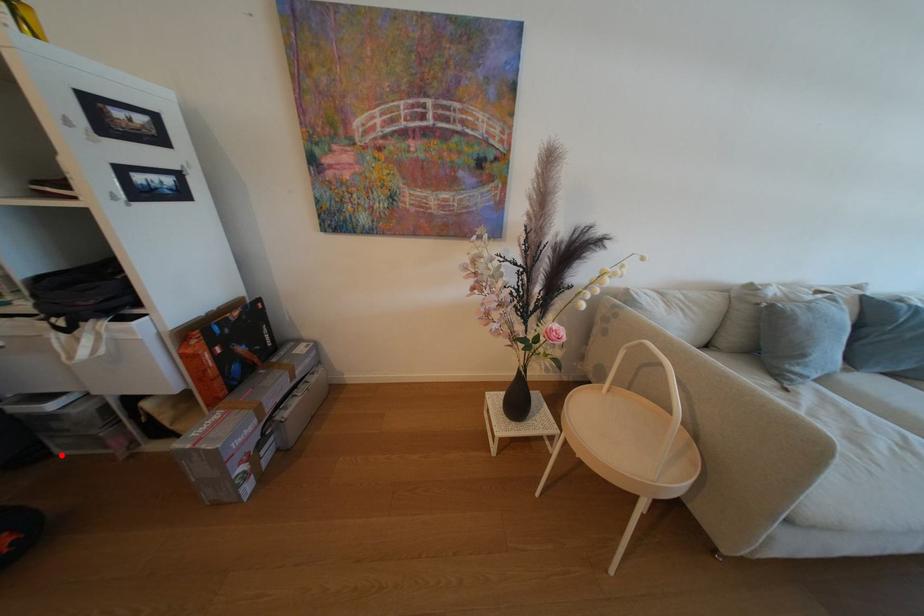
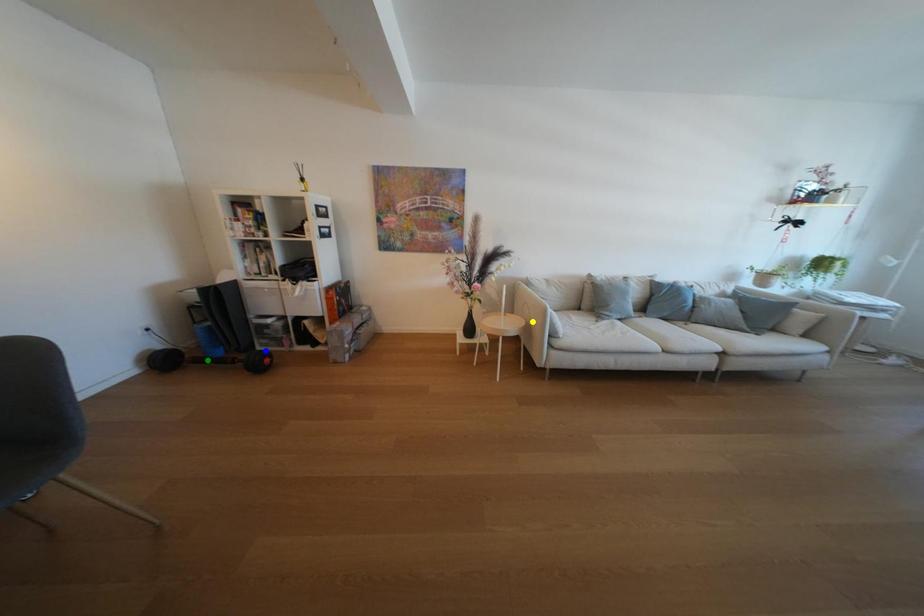
Question: I am providing you with two images of the same scene from different viewpoints. A red point is marked on the first image. You are given multiple points on the second image. Which mark in image 2 goes with the point in image 1?

Choices:
 (A) green point
 (B) blue point
 (C) yellow point

Answer: (B)